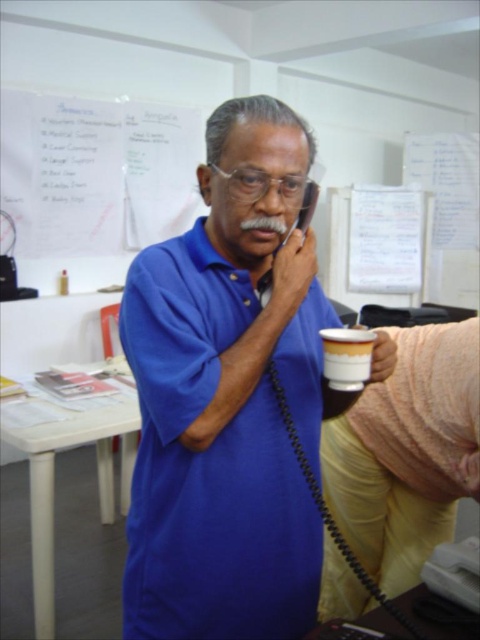
Question: Which point is closer to the camera taking this photo?

Choices:
 (A) (348, 378)
 (B) (147, 380)

Answer: (B)

Question: Is blue matte shirt at center above white matte cup at center?

Choices:
 (A) no
 (B) yes

Answer: (A)

Question: Which point appears farthest from the camera in this image?

Choices:
 (A) (206, 276)
 (B) (362, 332)

Answer: (B)

Question: Can you confirm if blue matte shirt at center is positioned to the left of white matte cup at center?

Choices:
 (A) yes
 (B) no

Answer: (A)

Question: Can you confirm if blue matte shirt at center is positioned to the left of white matte cup at center?

Choices:
 (A) no
 (B) yes

Answer: (B)

Question: Which of the following is the farthest from the observer?

Choices:
 (A) (373, 332)
 (B) (158, 340)

Answer: (A)